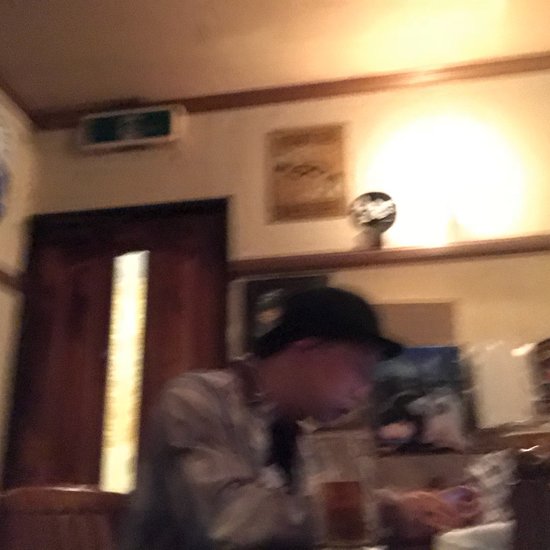
The width and height of the screenshot is (550, 550). I want to click on glass, so click(x=337, y=503).